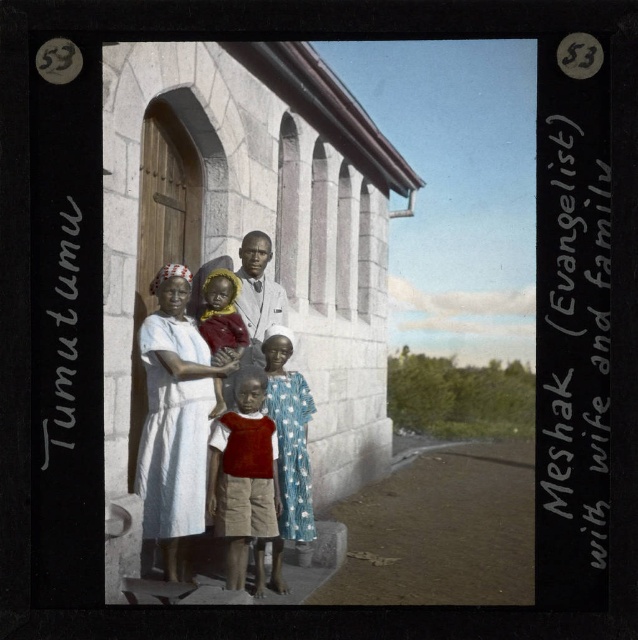
Question: Which point is closer to the camera taking this photo?

Choices:
 (A) (163, 321)
 (B) (204, 291)
 (C) (263, 298)
 (D) (271, 490)

Answer: (D)

Question: Is white cotton dress at center positioned in front of matte red cloth at center?

Choices:
 (A) no
 (B) yes

Answer: (B)

Question: Does white cotton dress at center appear on the right side of matte red cloth at center?

Choices:
 (A) no
 (B) yes

Answer: (A)

Question: Observing the image, what is the correct spatial positioning of white cotton dress at center in reference to matte red cloth at center?

Choices:
 (A) right
 (B) left

Answer: (B)

Question: Which point is closer to the camera taking this photo?

Choices:
 (A) (202, 348)
 (B) (218, 413)
 (C) (228, 556)

Answer: (C)

Question: Which of the following is the closest to the observer?

Choices:
 (A) white cotton dress at center
 (B) light brown skin tone at center

Answer: (A)